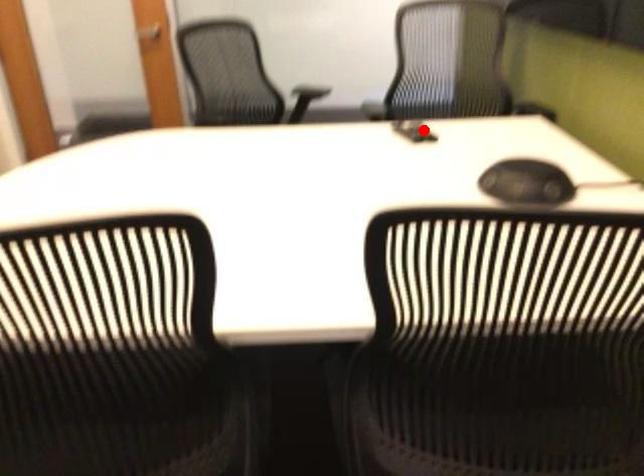
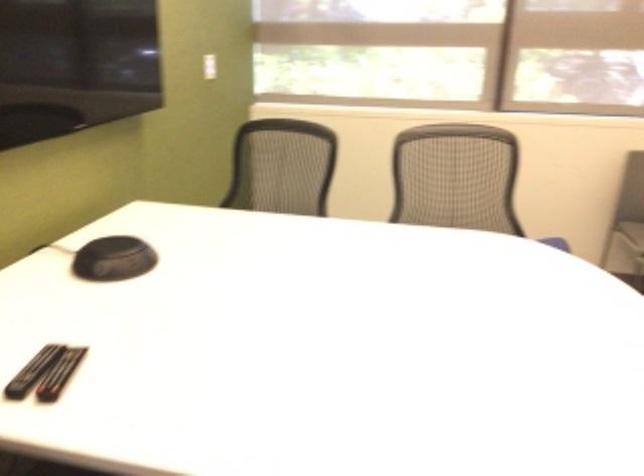
Question: A red point is marked in image1. In image2, is the corresponding 3D point closer to the camera or farther? Reply with the corresponding letter.

Choices:
 (A) The corresponding 3D point is closer.
 (B) The corresponding 3D point is farther.

Answer: (A)